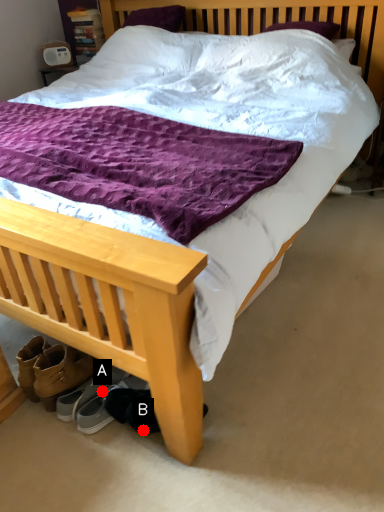
Question: Two points are circled on the image, labeled by A and B beside each circle. Which point is closer to the camera?

Choices:
 (A) A is closer
 (B) B is closer

Answer: (B)